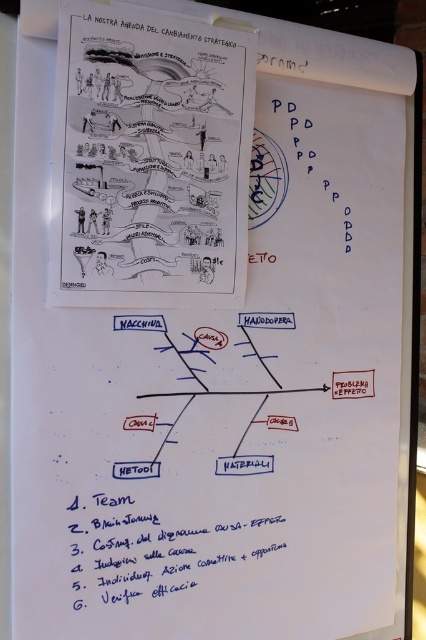
In the scene shown: You are an observer looking at the whiteboard. There are two objects labeled black paper poster at upper center and black paper at upper center. Which one is positioned to the left?

The black paper poster at upper center is to the left of the black paper at upper center.